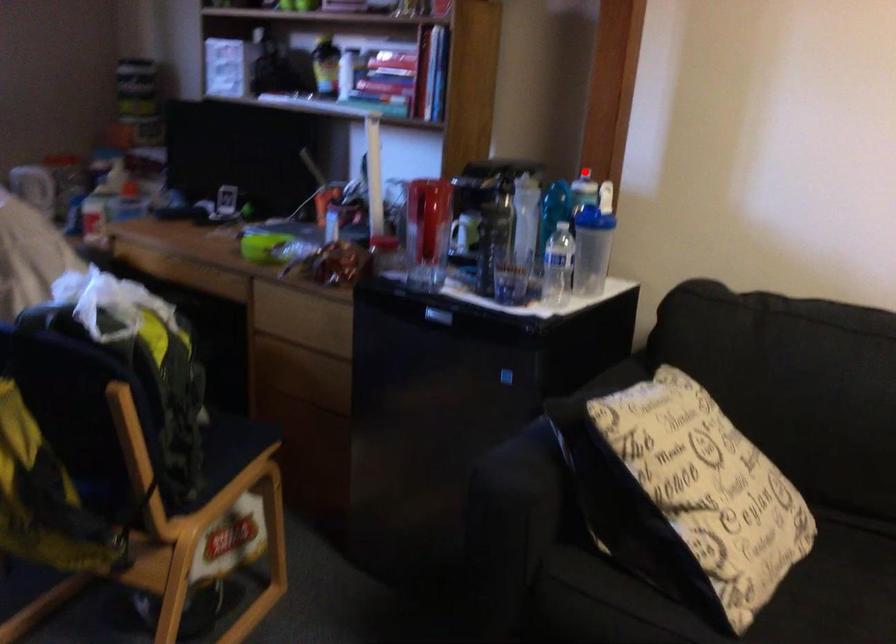
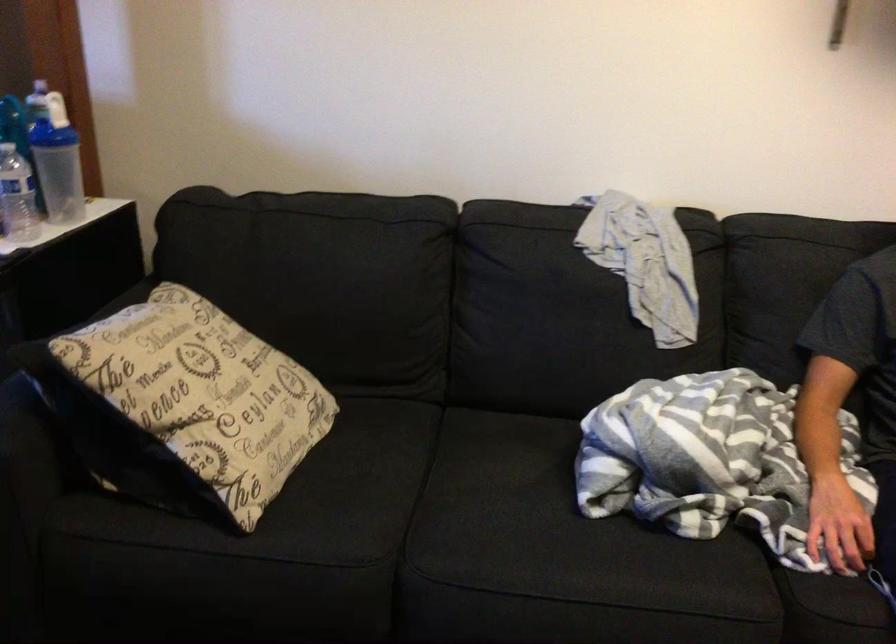
Question: I am providing you with two images of the same scene from different viewpoints. A red point is marked on the first image. Is the red point's position out of view in image 2?

Choices:
 (A) Yes
 (B) No

Answer: (B)